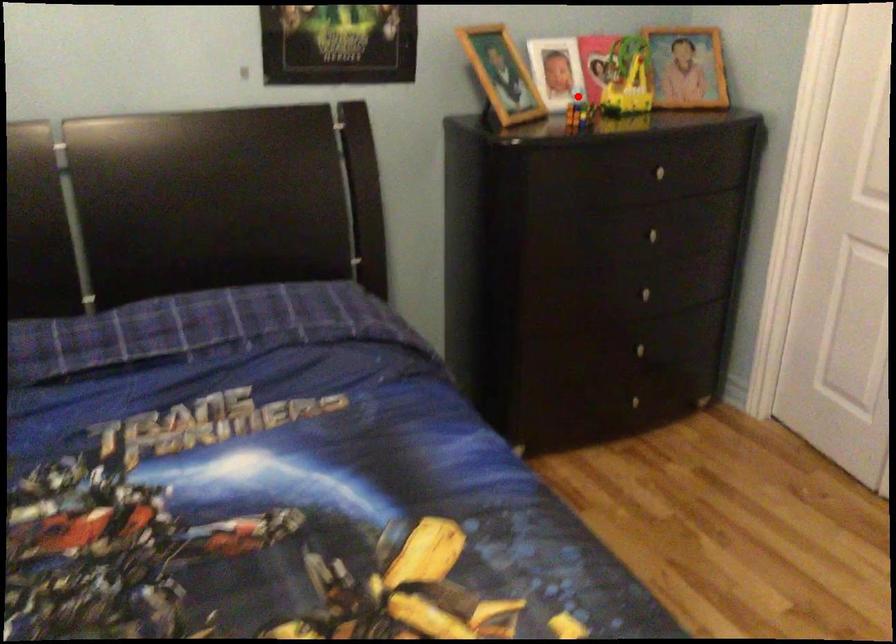
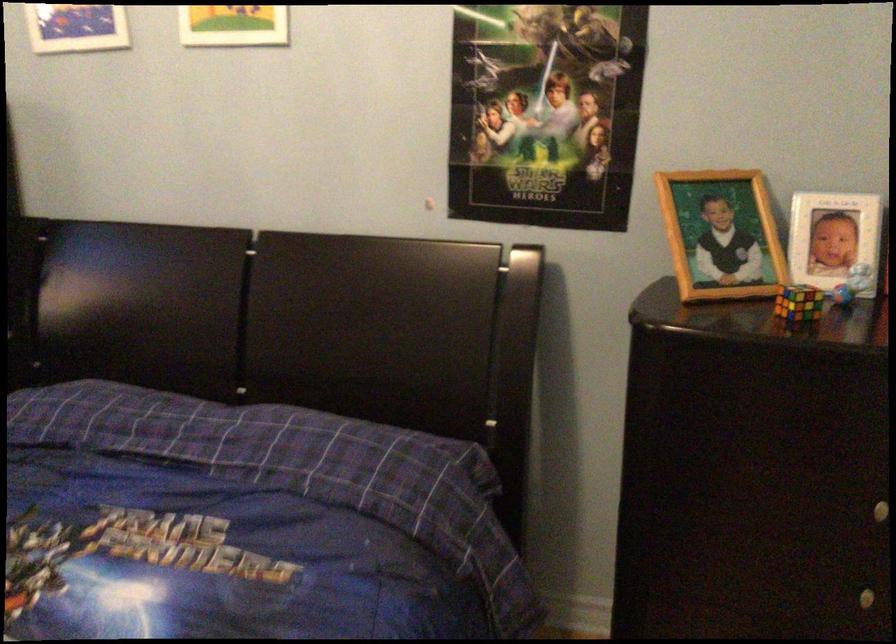
Question: I am providing you with two images of the same scene from different viewpoints. A red point is shown in image1. For the corresponding object point in image2, is it positioned nearer or farther from the camera?

Choices:
 (A) Nearer
 (B) Farther

Answer: (A)